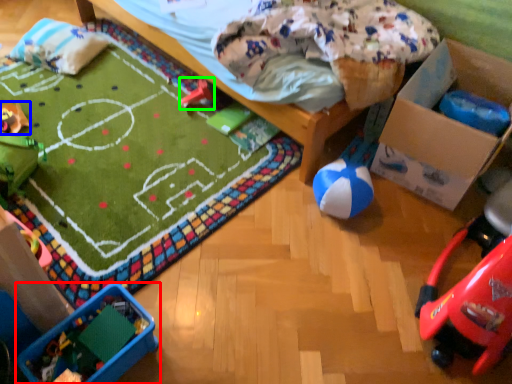
Question: Estimate the real-world distances between objects in this image. Which object is farther from toy (highlighted by a red box), toy (highlighted by a blue box) or toy (highlighted by a green box)?

Choices:
 (A) toy
 (B) toy

Answer: (B)